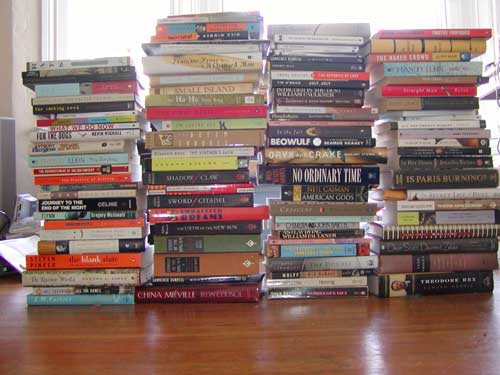
Find the location of a particular element. The height and width of the screenshot is (375, 500). cream wall is located at coordinates (8, 43).